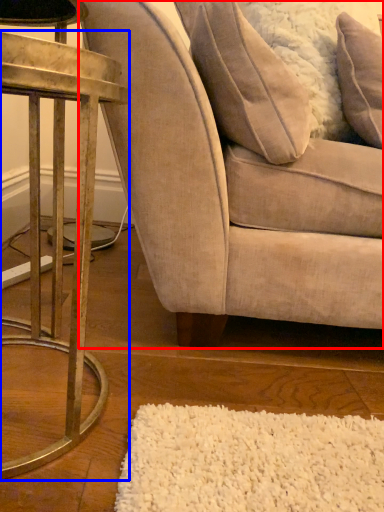
Question: Which of the following is the closest to the observer, chair (highlighted by a red box) or table (highlighted by a blue box)?

Choices:
 (A) chair
 (B) table

Answer: (B)